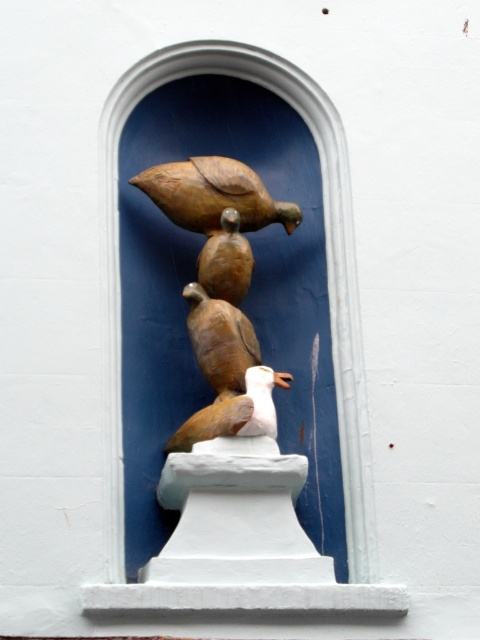
You are standing in front of the sculpture of four birds in the alcove. You want to reach a point marked at coordinates point (227,378). Considering your height is 5 feet 8 inches, can you physically touch this point without any assistance?

The point (227,378) is 196.66 feet away from the viewer. Since this distance is much greater than your height of 5 feet 8 inches, you cannot physically touch this point without assistance.

You are an art installer adjusting the sculpture. The point at coordinates [220,339] marks the center of the sculpture. Which object is located at this point?

The point at coordinates [220,339] indicates the brown matte bird at center.